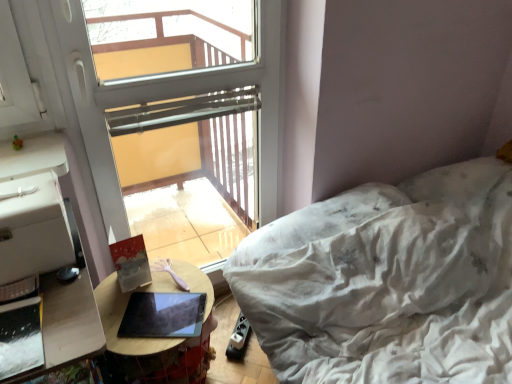
The height and width of the screenshot is (384, 512). What are the coordinates of `empty space that is ontop of matte black tablet at center (from a real-world perspective)` in the screenshot? It's located at (164, 310).